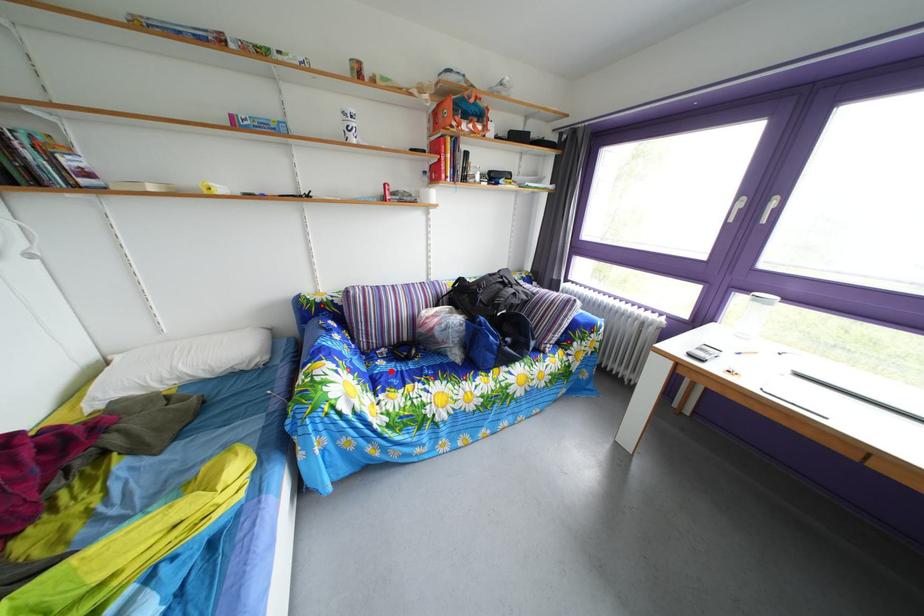
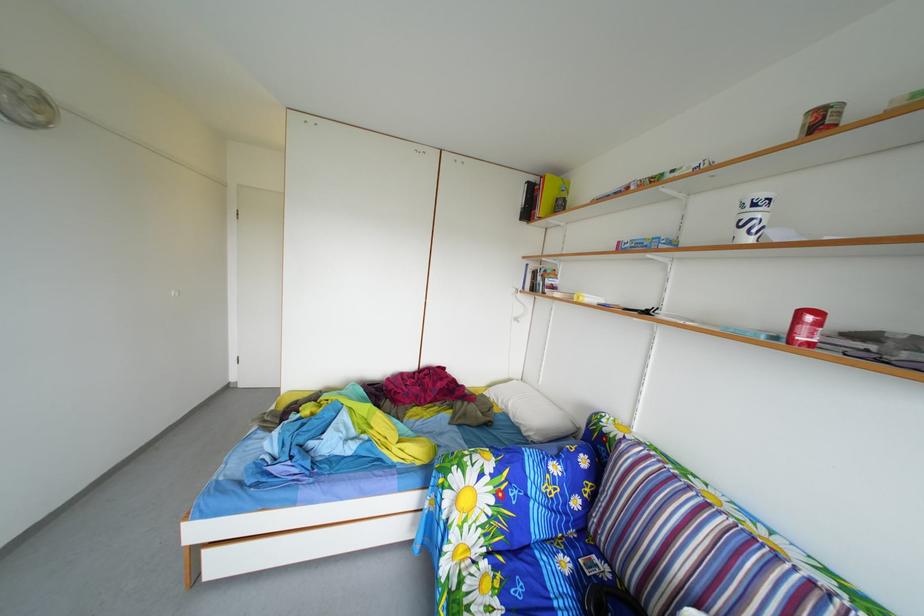
The point at the highlighted location is marked in the first image. Where is the corresponding point in the second image?

(576, 570)